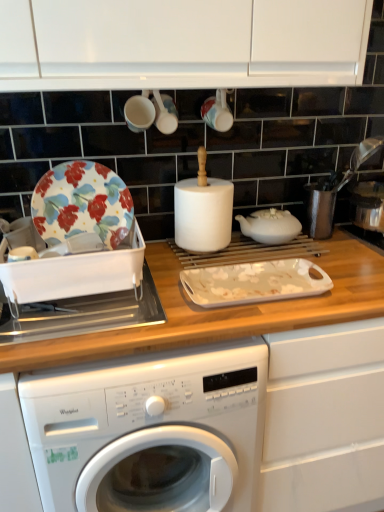
Question: From the image's perspective, is white glossy cup at upper center, positioned as the 2th tableware in left-to-right order, on wooden at center?

Choices:
 (A) yes
 (B) no

Answer: (A)

Question: From a real-world perspective, is white glossy cup at upper center, positioned as the 2th tableware in left-to-right order, under wooden at center?

Choices:
 (A) yes
 (B) no

Answer: (B)

Question: Can you confirm if white glossy cup at upper center, the 2th tableware in the right-to-left sequence, is positioned to the right of wooden at center?

Choices:
 (A) yes
 (B) no

Answer: (A)

Question: From the image's perspective, does white glossy cup at upper center, positioned as the 2th tableware in left-to-right order, appear lower than wooden at center?

Choices:
 (A) no
 (B) yes

Answer: (A)

Question: Does white glossy cup at upper center, positioned as the 2th tableware in left-to-right order, lie behind wooden at center?

Choices:
 (A) yes
 (B) no

Answer: (A)

Question: Looking at the image, does white glossy cup at upper center, positioned as the 2th tableware in left-to-right order, seem bigger or smaller compared to matte ceramic cup at upper center, positioned as the 3th tableware in left-to-right order?

Choices:
 (A) small
 (B) big

Answer: (A)

Question: Does point [x=168, y=129] appear closer or farther from the camera than point [x=206, y=120]?

Choices:
 (A) closer
 (B) farther

Answer: (A)

Question: Considering the positions of white glossy cup at upper center, positioned as the 2th tableware in left-to-right order, and matte ceramic cup at upper center, which is counted as the 1th tableware, starting from the right, in the image, is white glossy cup at upper center, positioned as the 2th tableware in left-to-right order, taller or shorter than matte ceramic cup at upper center, which is counted as the 1th tableware, starting from the right,?

Choices:
 (A) tall
 (B) short

Answer: (A)

Question: From the image's perspective, is white glossy cup at upper center, positioned as the 2th tableware in left-to-right order, above or below matte ceramic cup at upper center, which is counted as the 1th tableware, starting from the right?

Choices:
 (A) below
 (B) above

Answer: (A)

Question: In terms of width, does floral-patterned ceramic plate at left look wider or thinner when compared to matte white cup at upper center, which is the 3th tableware in right-to-left order?

Choices:
 (A) thin
 (B) wide

Answer: (A)

Question: From a real-world perspective, is floral-patterned ceramic plate at left above or below matte white cup at upper center, the first tableware when ordered from left to right?

Choices:
 (A) below
 (B) above

Answer: (A)

Question: Considering the positions of floral-patterned ceramic plate at left and matte white cup at upper center, which is the 3th tableware in right-to-left order, in the image, is floral-patterned ceramic plate at left taller or shorter than matte white cup at upper center, which is the 3th tableware in right-to-left order,?

Choices:
 (A) short
 (B) tall

Answer: (B)

Question: Choose the correct answer: Is floral-patterned ceramic plate at left inside matte white cup at upper center, which is the 3th tableware in right-to-left order, or outside it?

Choices:
 (A) inside
 (B) outside

Answer: (B)

Question: Does point (160, 121) appear closer or farther from the camera than point (81, 226)?

Choices:
 (A) farther
 (B) closer

Answer: (A)

Question: Relative to floral-patterned ceramic plate at left, is white glossy cup at upper center, positioned as the 2th tableware in left-to-right order, in front or behind?

Choices:
 (A) front
 (B) behind

Answer: (B)